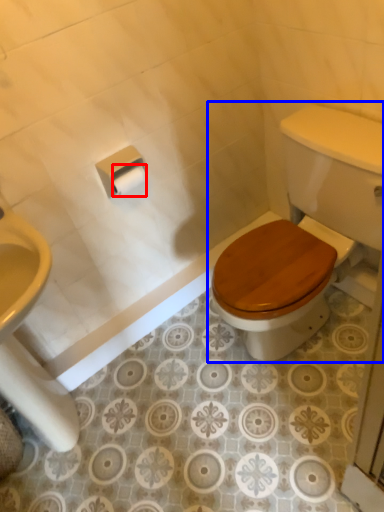
Question: Which point is further to the camera, toilet paper (highlighted by a red box) or toilet (highlighted by a blue box)?

Choices:
 (A) toilet paper
 (B) toilet

Answer: (A)